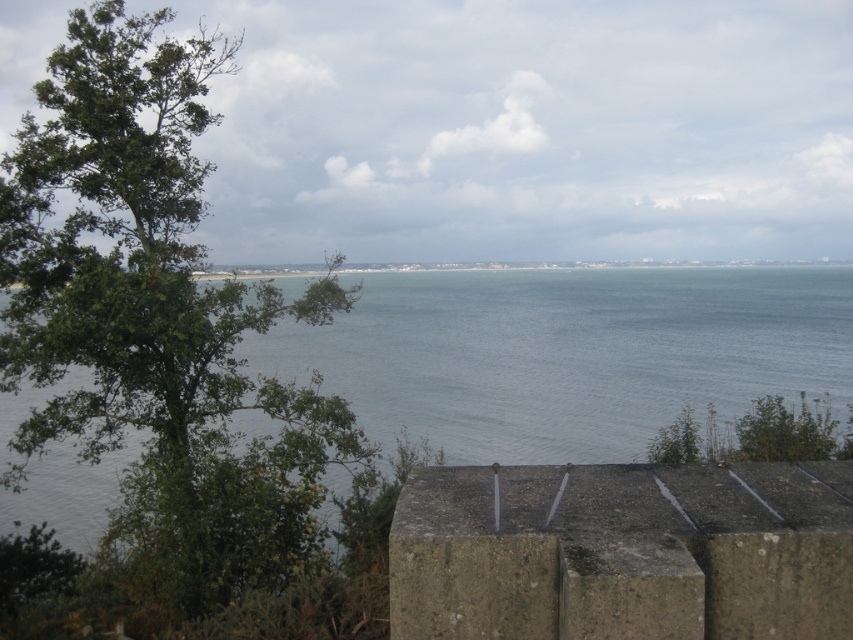
Question: Which object appears farthest from the camera in this image?

Choices:
 (A) blue water at center
 (B) concrete ledge at lower center
 (C) green leafy tree at left

Answer: (A)

Question: Which point is farther to the camera?

Choices:
 (A) blue water at center
 (B) green leafy tree at left
 (C) concrete ledge at lower center

Answer: (A)

Question: Can you confirm if blue water at center is positioned to the left of concrete ledge at lower center?

Choices:
 (A) yes
 (B) no

Answer: (B)

Question: Can you confirm if blue water at center is positioned above concrete ledge at lower center?

Choices:
 (A) yes
 (B) no

Answer: (A)

Question: Does green leafy tree at left appear on the left side of blue water at center?

Choices:
 (A) yes
 (B) no

Answer: (A)

Question: Which point is closer to the camera taking this photo?

Choices:
 (A) (39, 502)
 (B) (163, 58)

Answer: (B)